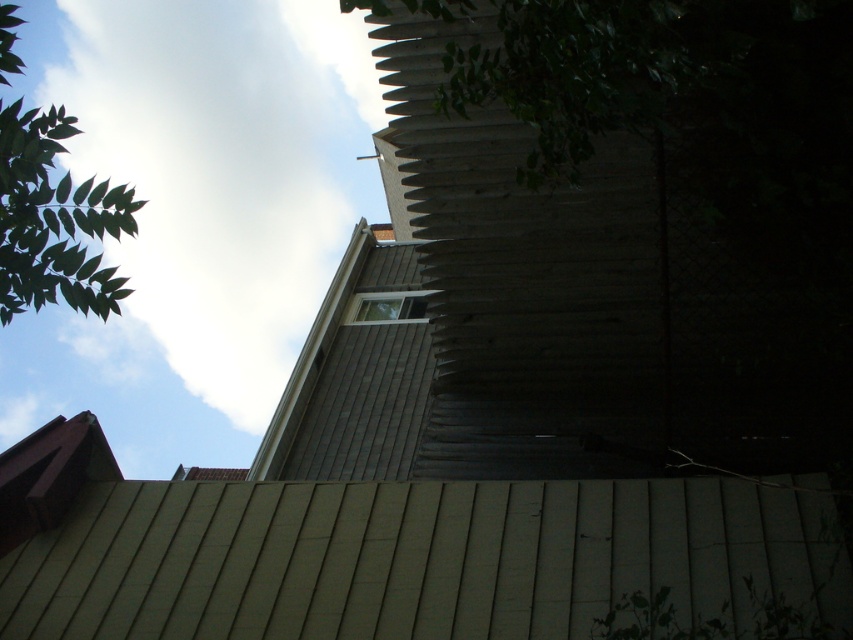
You are a painter standing on a ladder looking up at the building. You need to decide whether to paint the green leafy tree at upper left or the clear glass window at upper center first. Which object will require more horizontal space to paint because it is wider?

The green leafy tree at upper left requires more horizontal space to paint because its width is larger than the clear glass window at upper center.

You are standing on the ground looking up at the building. Which object, the green leafy tree at upper left or the clear glass window at upper center, would appear larger to you?

The green leafy tree at upper left appears larger because it is closer to the viewer than the clear glass window at upper center.